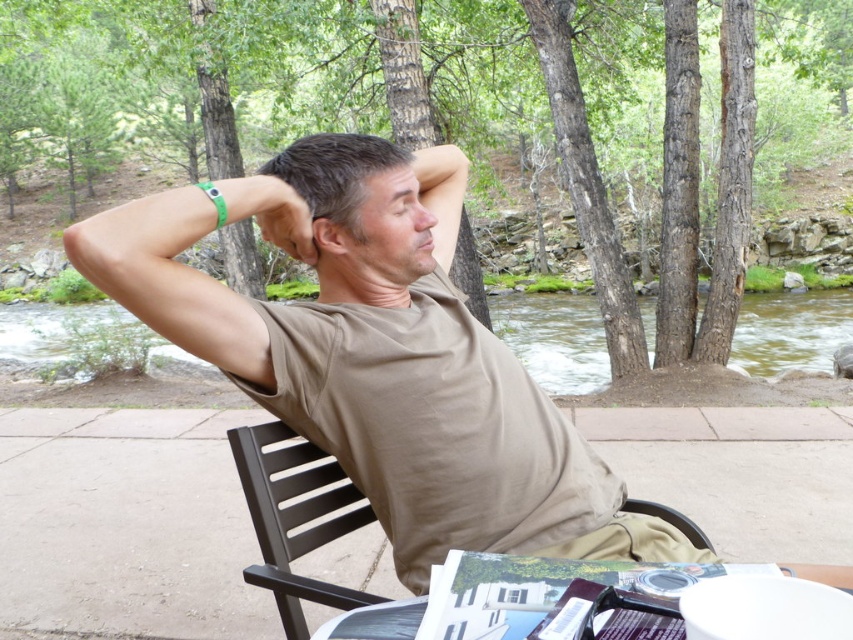
You are a fashion designer observing the man in the image. You need to determine which item, the tan cotton shirt at center or the brown plastic chair at center, would require more vertical space if you were to display them side by side in a store window. Which one needs more height?

The tan cotton shirt at center is much taller than the brown plastic chair at center, so it would require more vertical space when displayed side by side in a store window.

You are a delivery drone preparing to land on the patio. The landing zone must be at least 1.5 meters away from the camera to ensure safety. Is the point at coordinates point [404,532] suitable for landing?

The distance of point [404,532] from camera is 1.29 meters, which is less than the required 1.5 meters. Therefore, the point at coordinates point [404,532] is not suitable for landing.

You are a delivery person who needs to place a small package between the tan cotton shirt at center and the brown plastic chair at center. The package is 14 inches long. Can you fit the package between them without moving either object?

The distance between the tan cotton shirt at center and the brown plastic chair at center is 13.67 inches. Since the package is 14 inches long, which is slightly longer than the available space, it won measurements. You cannot fit the package between them without moving either object.